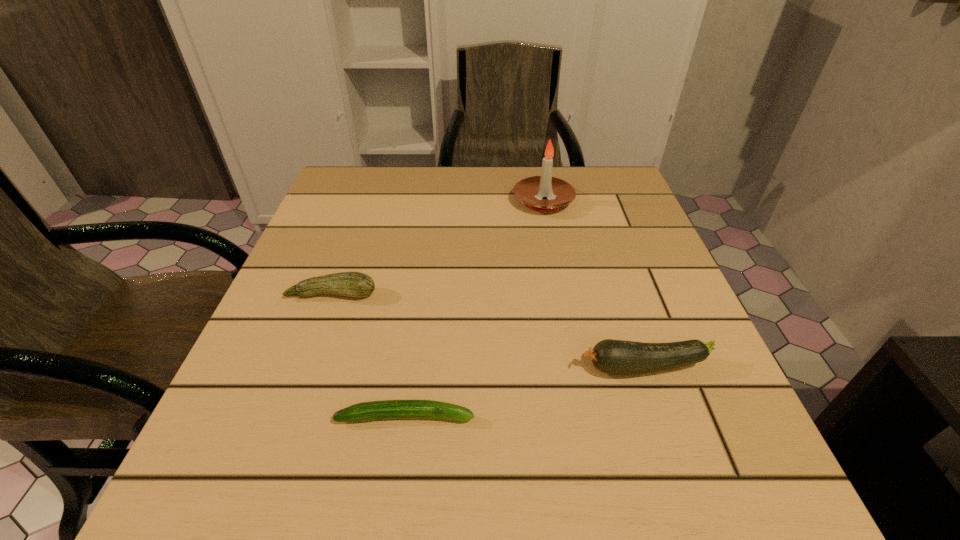
Image resolution: width=960 pixels, height=540 pixels. I want to click on free location located 0.320m at the blossom end of the second nearest zucchini, so click(x=373, y=368).

What are the coordinates of `vacant area located at the blossom end of the second nearest zucchini` in the screenshot? It's located at (520, 368).

This screenshot has height=540, width=960. Find the location of `free space located at the stem end of the farthest zucchini`. free space located at the stem end of the farthest zucchini is located at coordinates (290, 413).

Identify the location of vacant space located on the front-facing side of the nearest object. This screenshot has height=540, width=960. (587, 416).

The image size is (960, 540). In order to click on object located at the far edge in this screenshot , I will do `click(531, 191)`.

Find the location of a particular element. The height and width of the screenshot is (540, 960). object that is at the left edge is located at coordinates point(351,284).

This screenshot has height=540, width=960. I want to click on candle that is at the right edge, so click(531, 191).

Where is `zucchini at the right edge`? The image size is (960, 540). zucchini at the right edge is located at coordinates (615, 357).

This screenshot has height=540, width=960. What are the coordinates of `object located in the far right corner section of the desktop` in the screenshot? It's located at (531, 191).

Find the location of a particular element. free space at the far edge is located at coordinates (504, 205).